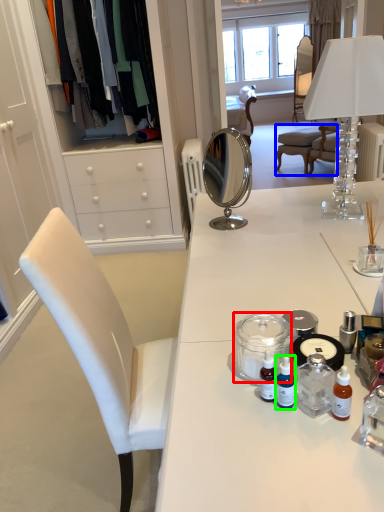
Question: Which object is positioned farthest from glass jar (highlighted by a red box)? Select from chair (highlighted by a blue box) and toiletry (highlighted by a green box).

Choices:
 (A) chair
 (B) toiletry

Answer: (A)